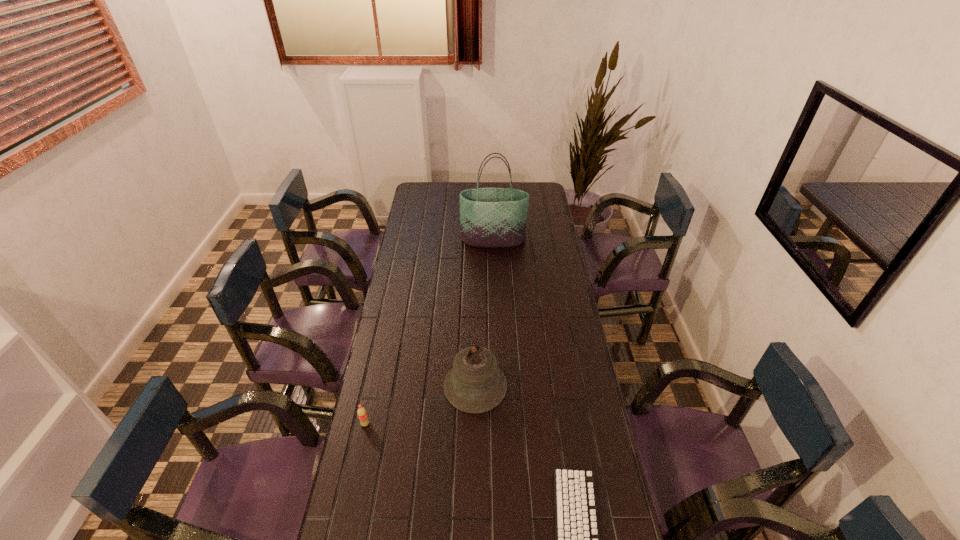
Find the location of a particular element. Image resolution: width=960 pixels, height=540 pixels. the tallest object is located at coordinates (489, 217).

This screenshot has width=960, height=540. What are the coordinates of `the farthest object` in the screenshot? It's located at (489, 217).

Locate an element on the screen. This screenshot has width=960, height=540. the second farthest object is located at coordinates (475, 384).

You are a GUI agent. You are given a task and a screenshot of the screen. Output one action in this format:
    pyautogui.click(x=<x>, y=<y>)
    Task: Click on the third shortest object
    
    Given the screenshot: What is the action you would take?
    pyautogui.click(x=475, y=384)

I want to click on the second nearest object, so click(362, 414).

Identify the location of the leftmost object. (362, 414).

Where is `vacant area situated on the back of the tote bag`? Image resolution: width=960 pixels, height=540 pixels. vacant area situated on the back of the tote bag is located at coordinates point(492,210).

Locate an element on the screen. This screenshot has width=960, height=540. free point located on the back of the second tallest object is located at coordinates (476, 346).

Find the location of a particular element. This screenshot has height=540, width=960. vacant space situated on the front of the second nearest object is located at coordinates (351, 486).

Locate an element on the screen. Image resolution: width=960 pixels, height=540 pixels. object positioned at the left edge is located at coordinates (362, 414).